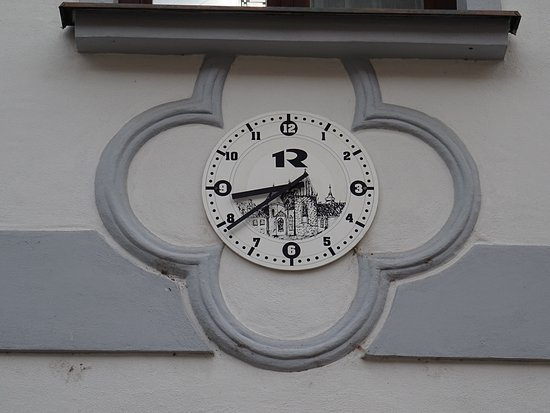
The image size is (550, 413). In order to click on molding in this screenshot , I will do `click(460, 175)`.